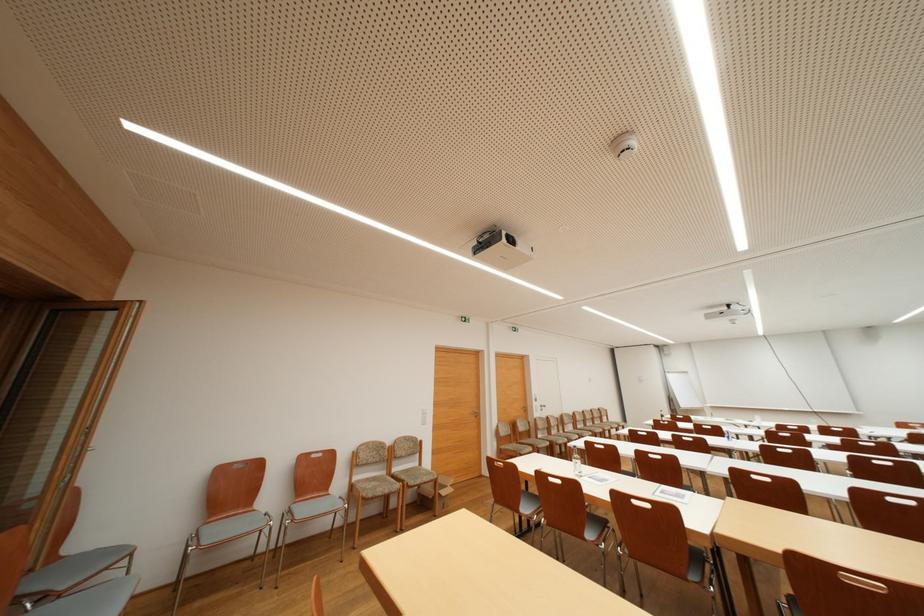
I want to click on clear water bottle, so click(576, 463).